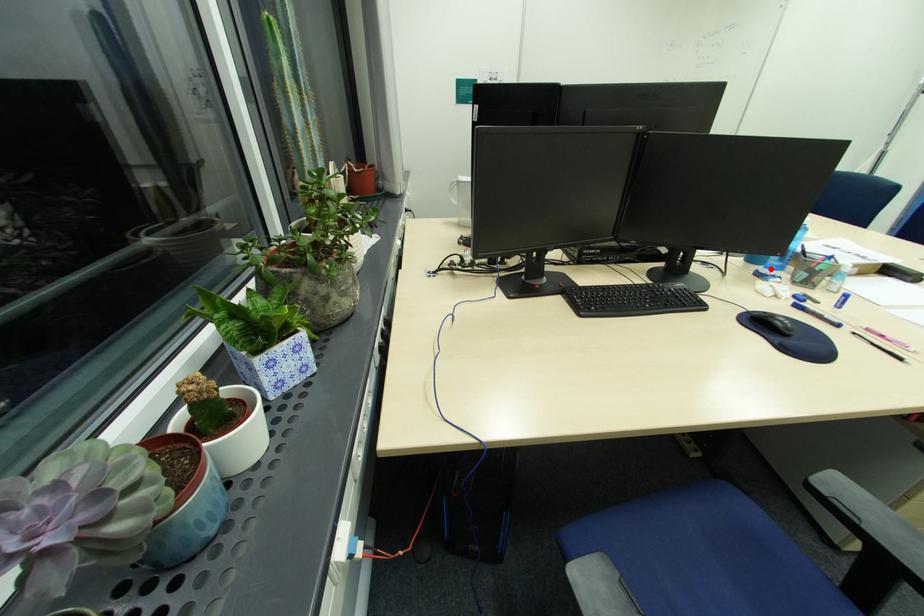
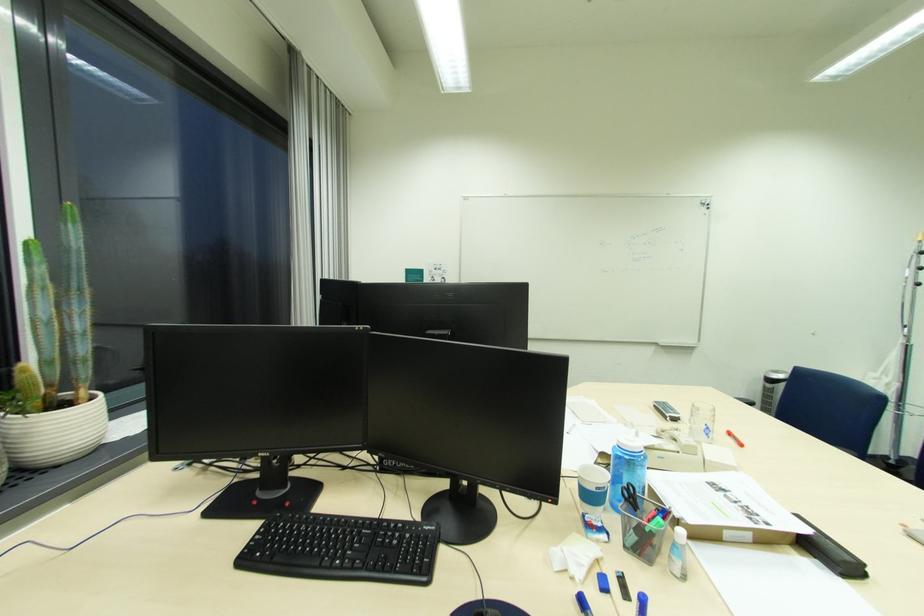
Question: I am providing you with two images of the same scene from different viewpoints. Image1 has a red point marked. In image2, the corresponding 3D location appears at what relative position? Reply with the corresponding letter.

Choices:
 (A) Closer
 (B) Farther

Answer: (B)